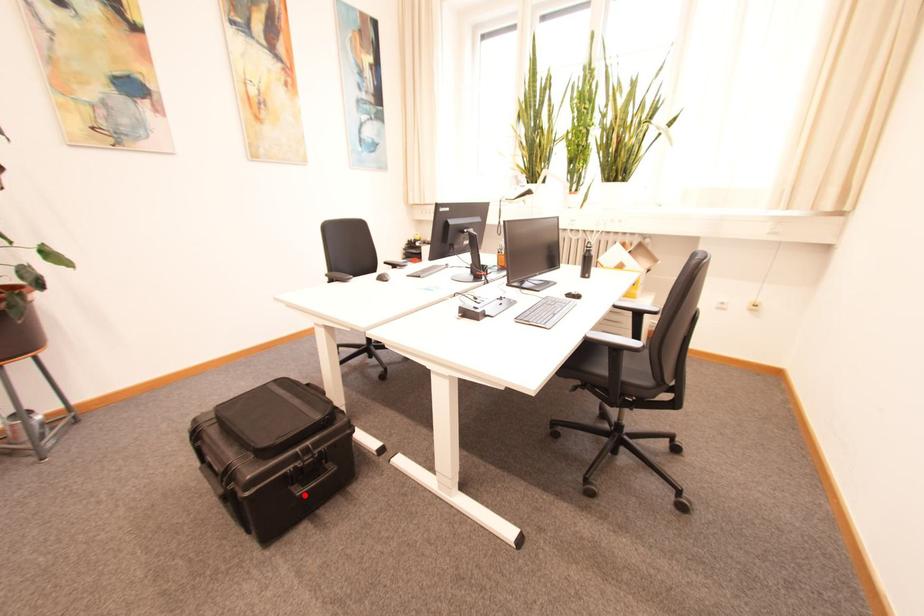
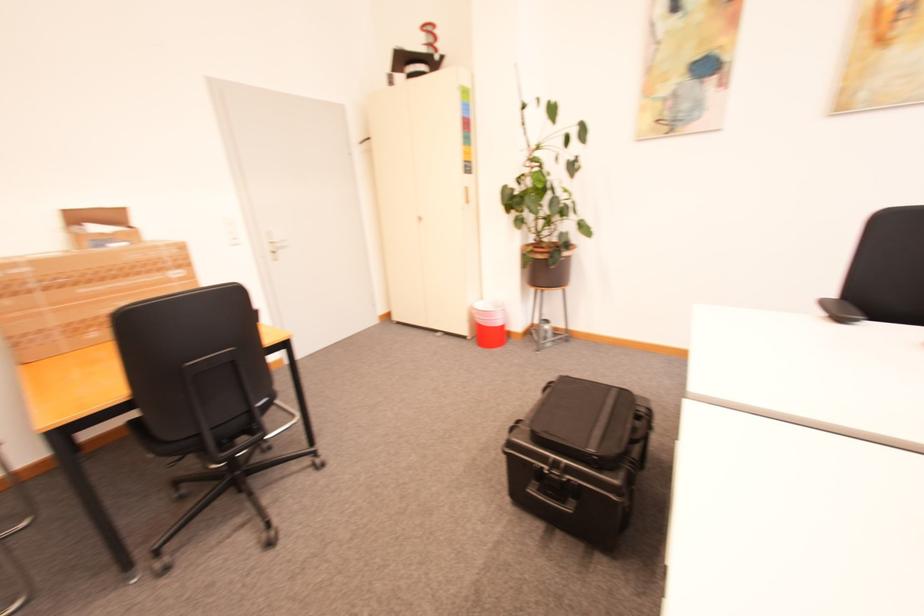
In the second image, find the point that corresponds to the highlighted location in the first image.

(535, 492)